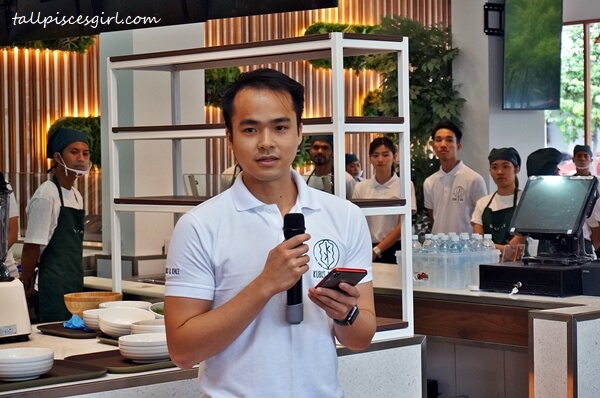
Where is `window`? window is located at coordinates (567, 121).